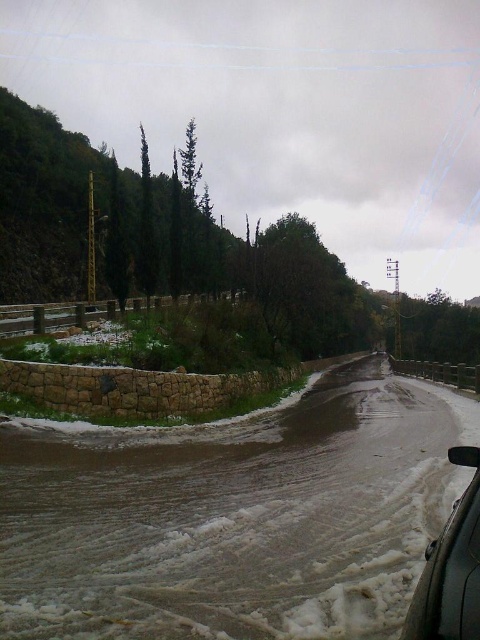
You are a pedestrian standing at the intersection and see the brown stone wall at lower left and the sleek black car at lower right. Which object is closer to you?

The brown stone wall at lower left is closer to you because the sleek black car at lower right is behind it.

You are a pedestrian standing on the road and want to cross to the grassy area behind the brown stone wall at lower left. The sleek black car at lower right is parked on the road. Can you safely walk around the car to reach the wall?

The brown stone wall at lower left is located below the sleek black car at lower right. This means the wall is closer to you than the car. Therefore, you can safely walk towards the wall without needing to go around the car, as it is already in front of the car.